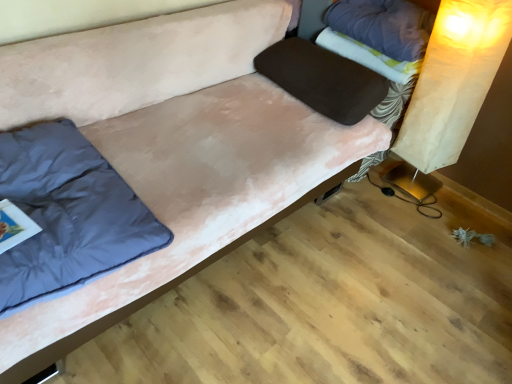
Question: Is purple fabric pillow at upper right, which is the third pillow in left-to-right order, located outside fluffy white blanket at upper right?

Choices:
 (A) no
 (B) yes

Answer: (B)

Question: Is purple fabric pillow at upper right, which is the third pillow in left-to-right order, at the right side of fluffy white blanket at upper right?

Choices:
 (A) no
 (B) yes

Answer: (B)

Question: From a real-world perspective, is purple fabric pillow at upper right, which is counted as the first pillow, starting from the right, positioned over fluffy white blanket at upper right based on gravity?

Choices:
 (A) yes
 (B) no

Answer: (A)

Question: Does purple fabric pillow at upper right, which is the third pillow in left-to-right order, have a greater width compared to fluffy white blanket at upper right?

Choices:
 (A) no
 (B) yes

Answer: (B)

Question: Is purple fabric pillow at upper right, which is the third pillow in left-to-right order, smaller than fluffy white blanket at upper right?

Choices:
 (A) yes
 (B) no

Answer: (B)

Question: Can you confirm if purple fabric pillow at upper right, which is counted as the first pillow, starting from the right, is positioned to the left of fluffy white blanket at upper right?

Choices:
 (A) yes
 (B) no

Answer: (B)

Question: Considering the relative positions of purple fabric pillow at upper right, which is the third pillow in left-to-right order, and velvet brown pillow at center, which is counted as the 2th pillow, starting from the left, in the image provided, is purple fabric pillow at upper right, which is the third pillow in left-to-right order, in front of velvet brown pillow at center, which is counted as the 2th pillow, starting from the left,?

Choices:
 (A) no
 (B) yes

Answer: (A)

Question: Is purple fabric pillow at upper right, which is counted as the first pillow, starting from the right, thinner than velvet brown pillow at center, the 2th pillow from the right?

Choices:
 (A) no
 (B) yes

Answer: (B)

Question: Is purple fabric pillow at upper right, which is counted as the first pillow, starting from the right, to the left of velvet brown pillow at center, which is counted as the 2th pillow, starting from the left, from the viewer's perspective?

Choices:
 (A) yes
 (B) no

Answer: (B)

Question: From the image's perspective, would you say purple fabric pillow at upper right, which is counted as the first pillow, starting from the right, is shown under velvet brown pillow at center, the 2th pillow from the right?

Choices:
 (A) yes
 (B) no

Answer: (B)

Question: From a real-world perspective, is purple fabric pillow at upper right, which is the third pillow in left-to-right order, located beneath velvet brown pillow at center, the 2th pillow from the right?

Choices:
 (A) no
 (B) yes

Answer: (A)

Question: Does purple fabric pillow at upper right, which is counted as the first pillow, starting from the right, have a larger size compared to velvet brown pillow at center, the 2th pillow from the right?

Choices:
 (A) no
 (B) yes

Answer: (A)

Question: From a real-world perspective, is dark blue fabric pillow at left, the first pillow from the left, over velvet brown pillow at center, which is counted as the 2th pillow, starting from the left?

Choices:
 (A) yes
 (B) no

Answer: (B)